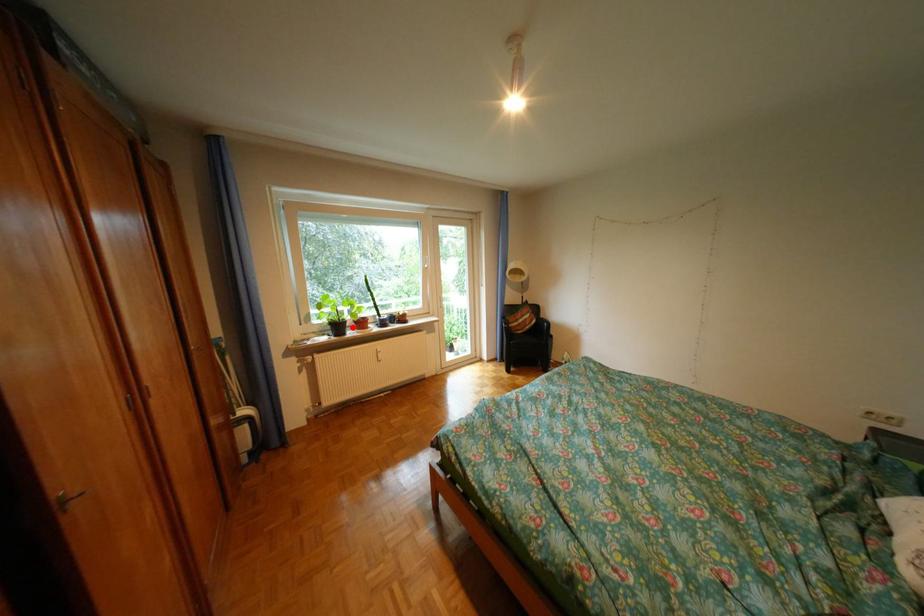
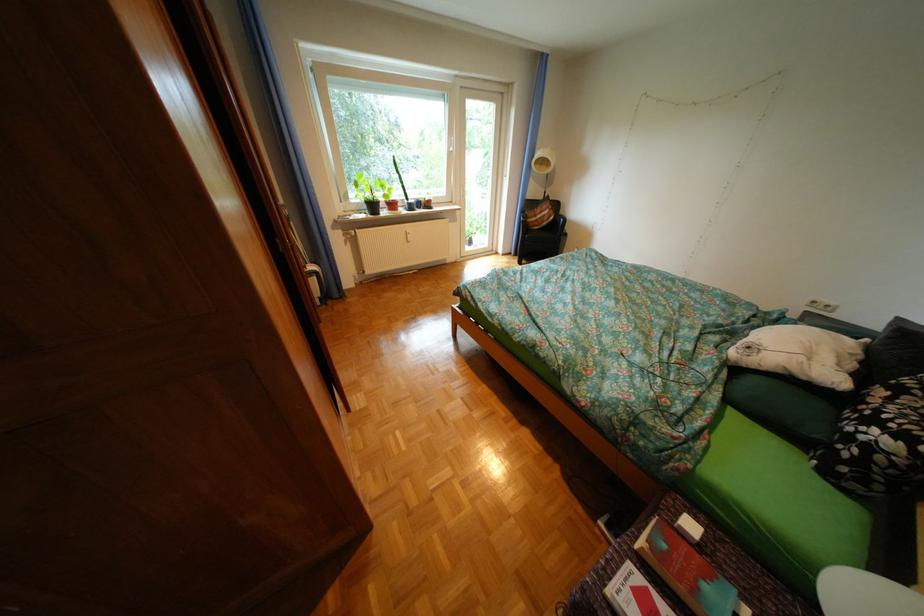
Question: I am providing you with two images of the same scene from different viewpoints. A red point is shown in image1. For the corresponding object point in image2, is it positioned nearer or farther from the camera?

Choices:
 (A) Nearer
 (B) Farther

Answer: (A)